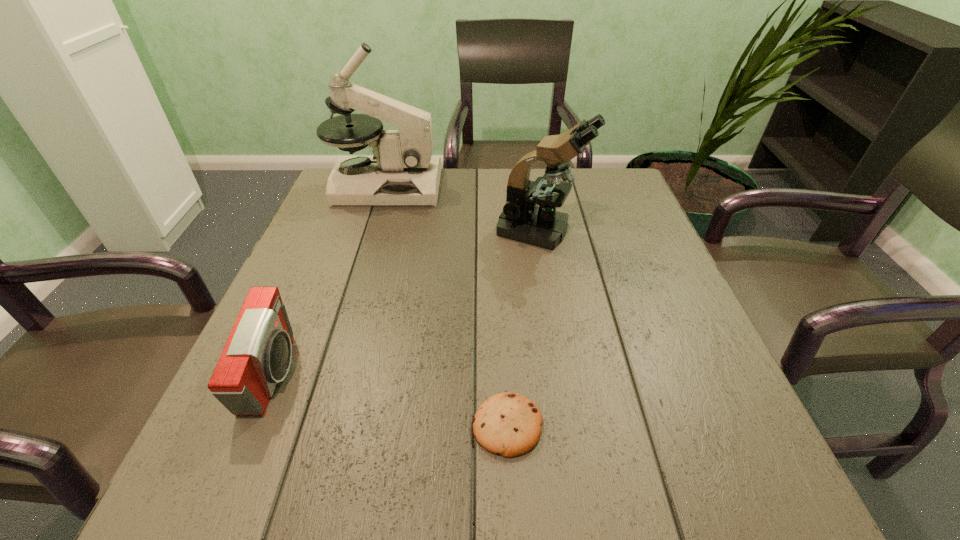
At what (x,y) coordinates should I click in order to perform the action: click on the farther microscope. Please return your answer as a coordinate pair (x, y). Looking at the image, I should click on (401, 172).

The width and height of the screenshot is (960, 540). I want to click on the farthest object, so click(x=401, y=172).

Image resolution: width=960 pixels, height=540 pixels. Find the location of `the third nearest object`. the third nearest object is located at coordinates (522, 220).

The image size is (960, 540). Identify the location of the right microscope. (522, 220).

At what (x,y) coordinates should I click in order to perform the action: click on the second shortest object. Please return your answer as a coordinate pair (x, y). Looking at the image, I should click on (257, 355).

Locate an element on the screen. cookie is located at coordinates (509, 424).

You are a GUI agent. You are given a task and a screenshot of the screen. Output one action in this format:
    pyautogui.click(x=<x>, y=<y>)
    Task: Click on the vacant area situated at the eyepiece of the farthest object
    This screenshot has height=540, width=960.
    Given the screenshot: What is the action you would take?
    pyautogui.click(x=493, y=186)

The width and height of the screenshot is (960, 540). What are the coordinates of `vacant area situated 0.310m on the front of the shorter microscope` in the screenshot? It's located at (563, 362).

Where is `free location located on the front-facing side of the camera`? This screenshot has height=540, width=960. free location located on the front-facing side of the camera is located at coordinates tap(444, 375).

What are the coordinates of `vacant space located on the right of the cookie` in the screenshot? It's located at (729, 426).